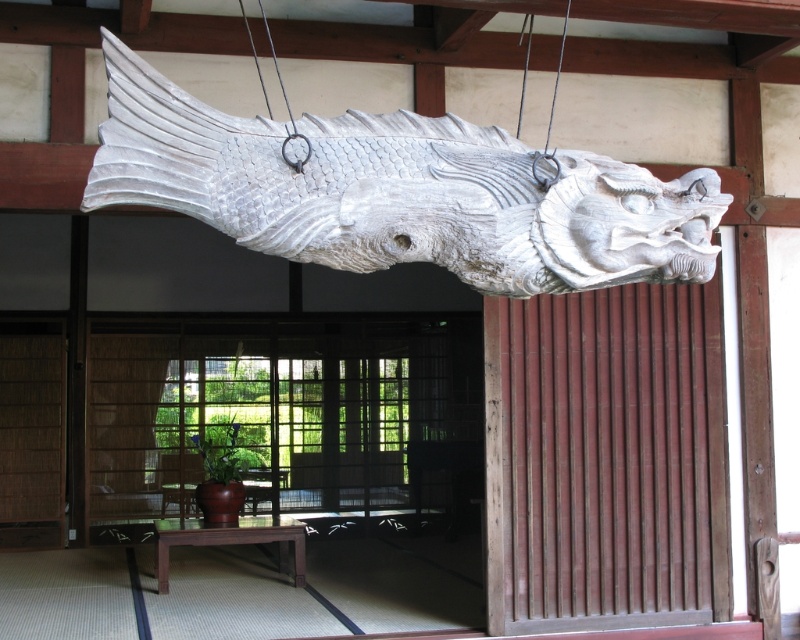
You are a delivery person carrying a package that is 10 meters long. You need to move it through the space between the wooden sliding door at center and the white wood fish at center. Can you fit the package through that space?

The distance between the wooden sliding door at center and the white wood fish at center is 9.02 meters, which is shorter than the 10 meters length of the package. Therefore, the package cannot fit through the space.